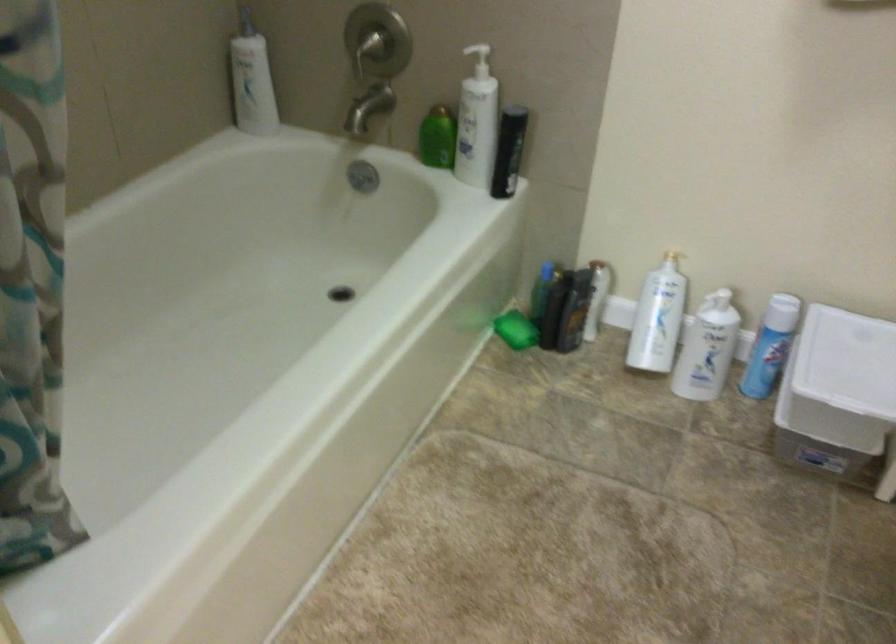
You are a GUI agent. You are given a task and a screenshot of the screen. Output one action in this format:
    pyautogui.click(x=<x>, y=<y>)
    Task: Click on the green shampoo bottle
    The height and width of the screenshot is (644, 896).
    Given the screenshot: What is the action you would take?
    pyautogui.click(x=437, y=138)